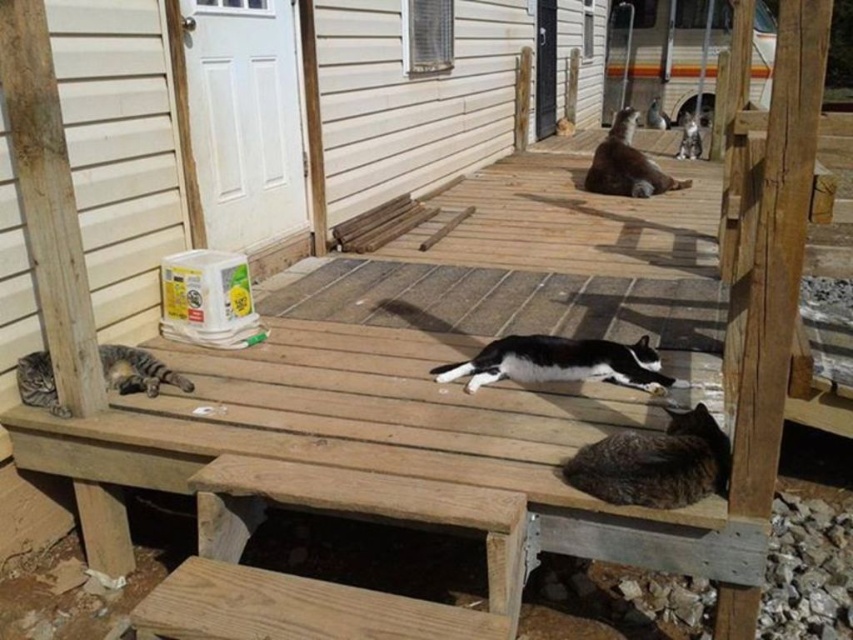
Question: Which point is farther from the camera taking this photo?

Choices:
 (A) (560, 358)
 (B) (612, 468)
 (C) (45, 397)
 (D) (611, 192)

Answer: (D)

Question: Is brown speckled fur cat at lower right positioned at the back of gray fur cat at upper right?

Choices:
 (A) no
 (B) yes

Answer: (A)

Question: Is brown speckled fur cat at lower right smaller than black and white fur cat at center?

Choices:
 (A) yes
 (B) no

Answer: (A)

Question: Can you confirm if striped fur cat at lower left is smaller than gray fur cat at upper right?

Choices:
 (A) no
 (B) yes

Answer: (B)

Question: Which object is positioned closest to the gray fur cat at upper right?

Choices:
 (A) brown speckled fur cat at lower right
 (B) brown fur cat at upper center
 (C) black and white fur cat at center
 (D) striped fur cat at lower left

Answer: (B)

Question: Among these points, which one is nearest to the camera?

Choices:
 (A) (622, 141)
 (B) (688, 147)
 (C) (625, 380)
 (D) (61, 410)

Answer: (D)